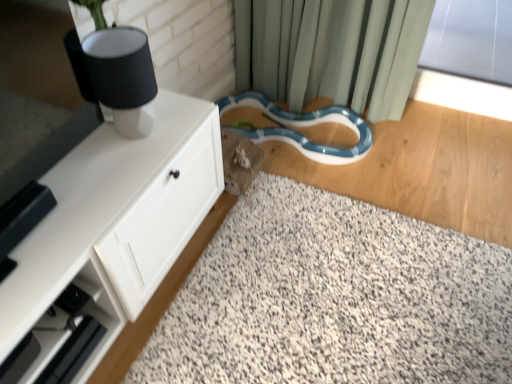
What are the coordinates of `free spot above white matte cabinet at left (from a real-world perspective)` in the screenshot? It's located at (97, 183).